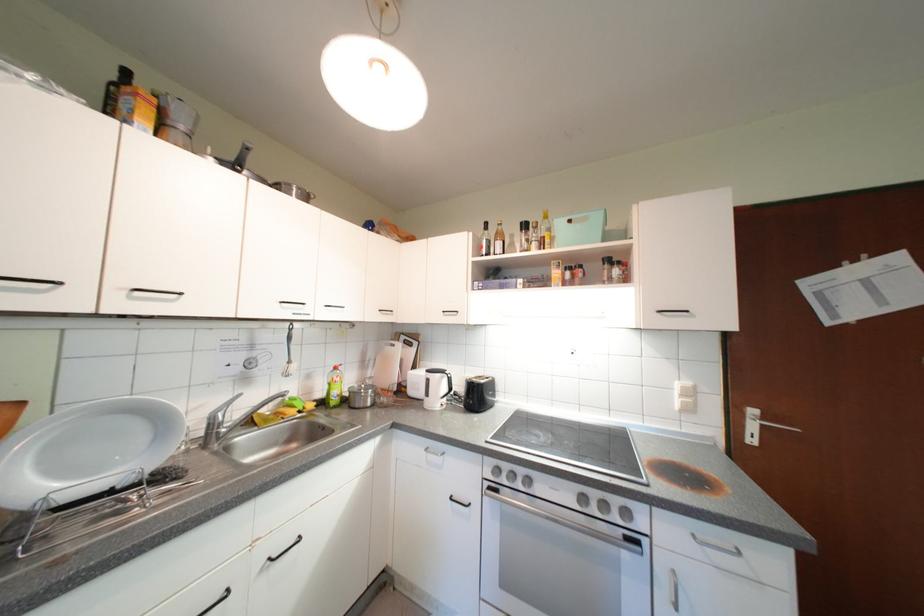
At what (x,y) coordinates should I click in order to perform the action: click on kettle handle. Please return your answer as a coordinate pair (x, y). This screenshot has width=924, height=616. Looking at the image, I should click on (451, 390).